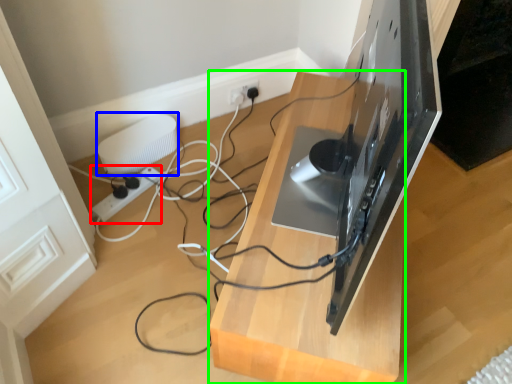
Question: Estimate the real-world distances between objects in this image. Which object is closer to extension cord (highlighted by a red box), appliance (highlighted by a blue box) or furniture (highlighted by a green box)?

Choices:
 (A) appliance
 (B) furniture

Answer: (A)